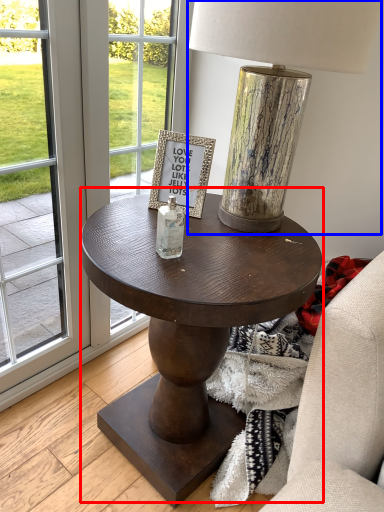
Question: Which of the following is the farthest to the observer, coffee table (highlighted by a red box) or table lamp (highlighted by a blue box)?

Choices:
 (A) coffee table
 (B) table lamp

Answer: (A)